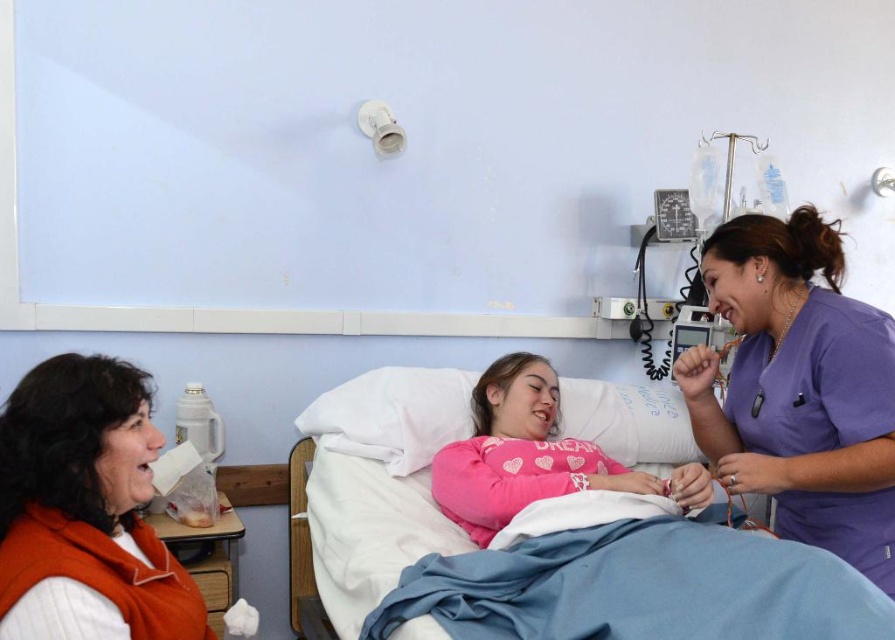
Question: Does orange fleece vest at left appear on the left side of pink cotton pillow at center?

Choices:
 (A) yes
 (B) no

Answer: (A)

Question: Is purple scrubs at center in front of pink cotton pillow at center?

Choices:
 (A) yes
 (B) no

Answer: (A)

Question: Among these objects, which one is nearest to the camera?

Choices:
 (A) pink fabric bed at center
 (B) purple scrubs at center
 (C) orange fleece vest at left

Answer: (C)

Question: Does purple scrubs at center have a greater width compared to orange fleece vest at left?

Choices:
 (A) yes
 (B) no

Answer: (A)

Question: Which point is closer to the camera?

Choices:
 (A) (777, 264)
 (B) (391, 484)
 (C) (497, 458)
 (D) (431, 408)

Answer: (A)

Question: Which of the following is the farthest from the observer?

Choices:
 (A) pink cotton pillow at center
 (B) white soft pillow at center
 (C) pink fabric bed at center

Answer: (B)